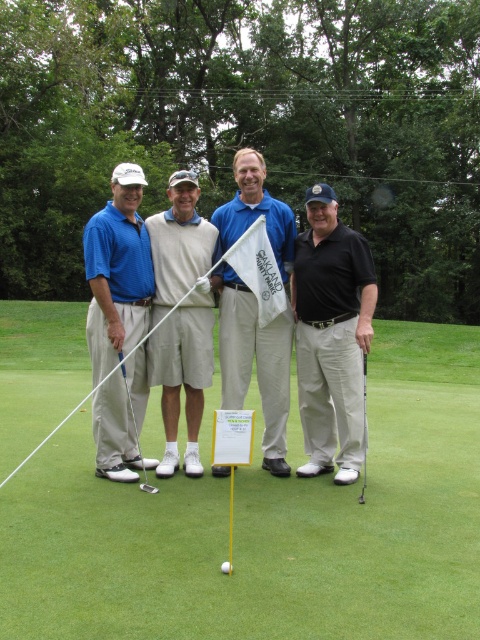
Looking at this image, you are a photographer taking a picture of the blue cotton polo shirt at center and the metallic silver golf club at center. Which object appears bigger in the photo?

The blue cotton polo shirt at center appears bigger in the photo since it has a larger size compared to the metallic silver golf club at center.

You are a golfer who just arrived at the golf course and see the green grass at center and the shiny silver putter at lower left. Which object takes up more space in the image?

The green grass at center takes up more space in the image because it has a larger size compared to the shiny silver putter at lower left.